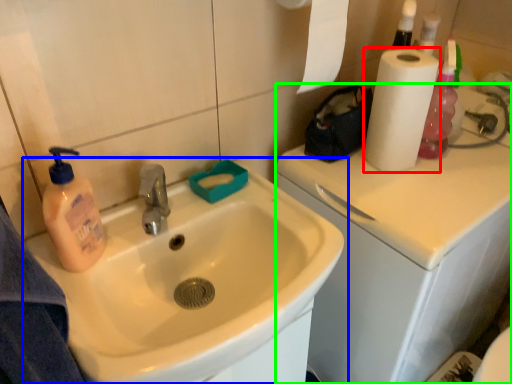
Question: Estimate the real-world distances between objects in this image. Which object is farther from paper towel (highlighted by a red box), sink (highlighted by a blue box) or counter top (highlighted by a green box)?

Choices:
 (A) sink
 (B) counter top

Answer: (A)